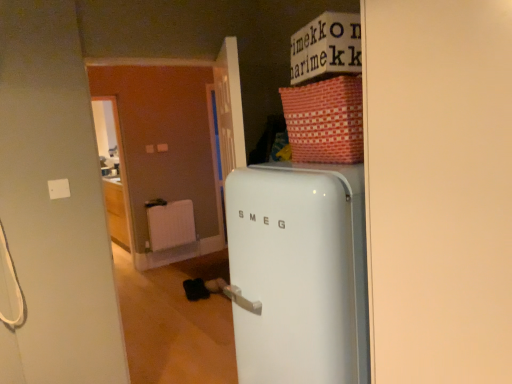
Where is `red woven basket at upper right`? Image resolution: width=512 pixels, height=384 pixels. red woven basket at upper right is located at coordinates (325, 121).

This screenshot has height=384, width=512. Describe the element at coordinates (170, 225) in the screenshot. I see `white matte radiator at center` at that location.

This screenshot has height=384, width=512. Describe the element at coordinates (298, 272) in the screenshot. I see `white glossy refrigerator at center` at that location.

Where is `white glossy refrigerator at center`? The image size is (512, 384). white glossy refrigerator at center is located at coordinates (298, 272).

Find the location of a particular element. red woven basket at upper right is located at coordinates (325, 121).

In the image, is white matte radiator at center positioned in front of or behind white glossy refrigerator at center?

white matte radiator at center is positioned farther from the viewer than white glossy refrigerator at center.

In the scene shown: From a real-world perspective, is white matte radiator at center beneath white glossy refrigerator at center?

Indeed, from a real-world perspective, white matte radiator at center is positioned beneath white glossy refrigerator at center.

Considering the positions of objects white matte radiator at center and white glossy refrigerator at center in the image provided, who is more to the left, white matte radiator at center or white glossy refrigerator at center?

white matte radiator at center.

Is point (155, 224) positioned before point (290, 263)?

No, (155, 224) is further to viewer.

Identify the location of refrigerator that appears on the right of white matte radiator at center. The width and height of the screenshot is (512, 384). (298, 272).

Between white glossy refrigerator at center and white matte radiator at center, which one is positioned behind?

white matte radiator at center is further away from the camera.

Is white glossy refrigerator at center inside or outside of white matte radiator at center?

white glossy refrigerator at center is spatially situated outside white matte radiator at center.

Does point (315, 150) lie behind point (189, 235)?

No, (315, 150) is in front of (189, 235).

From the image's perspective, between red woven basket at upper right and white matte radiator at center, which one is located above?

red woven basket at upper right is shown above in the image.

Would you say red woven basket at upper right is a long distance from white matte radiator at center?

Yes, red woven basket at upper right and white matte radiator at center are quite far apart.

The image size is (512, 384). What are the coordinates of `radiator to the left of red woven basket at upper right` in the screenshot? It's located at (170, 225).

From a real-world perspective, between white matte radiator at center and red woven basket at upper right, who is vertically lower?

In real-world perspective, white matte radiator at center is lower.

Is red woven basket at upper right located within white matte radiator at center?

No, white matte radiator at center does not contain red woven basket at upper right.

Is white matte radiator at center facing away from red woven basket at upper right?

No.

From the image's perspective, which one is positioned lower, white glossy refrigerator at center or red woven basket at upper right?

white glossy refrigerator at center.

Consider the image. Is white glossy refrigerator at center placed right next to red woven basket at upper right?

No, white glossy refrigerator at center is not in contact with red woven basket at upper right.

Can you confirm if white glossy refrigerator at center is bigger than red woven basket at upper right?

Indeed, white glossy refrigerator at center has a larger size compared to red woven basket at upper right.

Based on their sizes in the image, would you say red woven basket at upper right is bigger or smaller than white glossy refrigerator at center?

Considering their sizes, red woven basket at upper right takes up less space than white glossy refrigerator at center.

Is red woven basket at upper right wider or thinner than white glossy refrigerator at center?

red woven basket at upper right is thinner than white glossy refrigerator at center.

From a real-world perspective, is red woven basket at upper right below white glossy refrigerator at center?

No, from a real-world perspective, red woven basket at upper right is not below white glossy refrigerator at center.

In the image, there is a red woven basket at upper right. Where is `refrigerator below it (from a real-world perspective)`? refrigerator below it (from a real-world perspective) is located at coordinates (298, 272).

This screenshot has width=512, height=384. What are the coordinates of `radiator above the white glossy refrigerator at center (from the image's perspective)` in the screenshot? It's located at (170, 225).

The width and height of the screenshot is (512, 384). I want to click on radiator beneath the white glossy refrigerator at center (from a real-world perspective), so click(x=170, y=225).

Which object lies nearer to the anchor point red woven basket at upper right, white glossy refrigerator at center or white matte radiator at center?

The object closer to red woven basket at upper right is white glossy refrigerator at center.

From the image, which object appears to be farther from white matte radiator at center, white glossy refrigerator at center or red woven basket at upper right?

The object further to white matte radiator at center is red woven basket at upper right.

In the scene shown: Considering their positions, is white matte radiator at center positioned closer to red woven basket at upper right than white glossy refrigerator at center?

white glossy refrigerator at center lies closer to red woven basket at upper right than the other object.

Estimate the real-world distances between objects in this image. Which object is closer to white matte radiator at center, red woven basket at upper right or white glossy refrigerator at center?

white glossy refrigerator at center.

Which object lies nearer to the anchor point white glossy refrigerator at center, red woven basket at upper right or white matte radiator at center?

Based on the image, red woven basket at upper right appears to be nearer to white glossy refrigerator at center.

Looking at the image, which one is located further to white glossy refrigerator at center, white matte radiator at center or red woven basket at upper right?

white matte radiator at center is positioned further to the anchor white glossy refrigerator at center.

The width and height of the screenshot is (512, 384). Find the location of `cardboard box positioned between white glossy refrigerator at center and white matte radiator at center from near to far`. cardboard box positioned between white glossy refrigerator at center and white matte radiator at center from near to far is located at coordinates (325, 121).